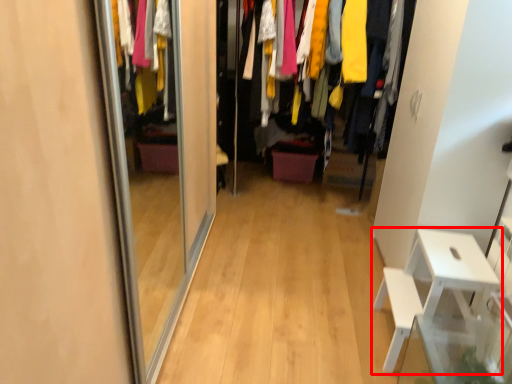
Question: Considering the relative positions of furniture (annotated by the red box) and closet in the image provided, where is furniture (annotated by the red box) located with respect to the staircase?

Choices:
 (A) left
 (B) right

Answer: (B)